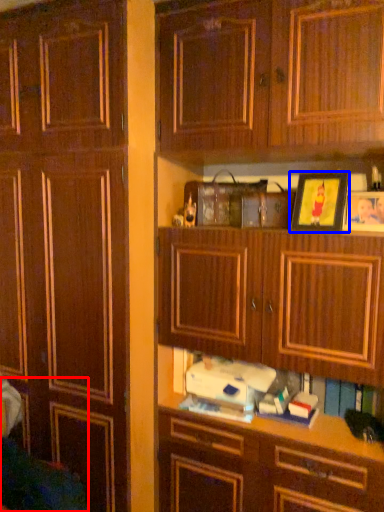
Question: Which object appears closest to the camera in this image, swivel chair (highlighted by a red box) or picture frame (highlighted by a blue box)?

Choices:
 (A) swivel chair
 (B) picture frame

Answer: (A)